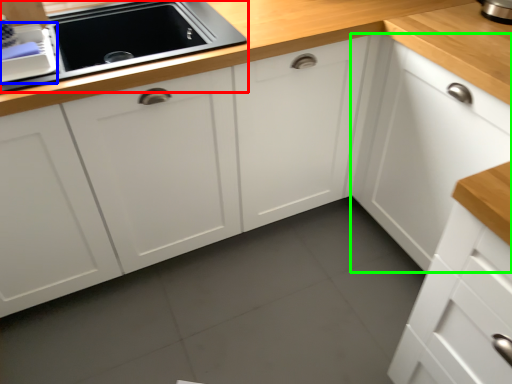
Question: Based on their relative distances, which object is nearer to home appliance (highlighted by a red box)? Choose from appliance (highlighted by a blue box) and cabinetry (highlighted by a green box).

Choices:
 (A) appliance
 (B) cabinetry

Answer: (A)